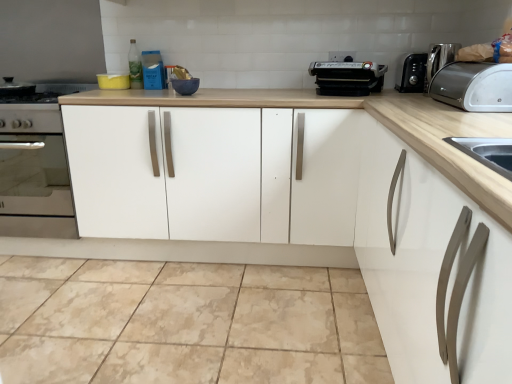
Question: From a real-world perspective, is satin silver toaster at upper right above or below green glass bottle at upper center?

Choices:
 (A) above
 (B) below

Answer: (B)

Question: Which is correct: satin silver toaster at upper right is inside green glass bottle at upper center, or outside of it?

Choices:
 (A) outside
 (B) inside

Answer: (A)

Question: Which of these objects is positioned farthest from the beige marble tile at center?

Choices:
 (A) satin silver coffee machine at upper right
 (B) white matte cabinet at center
 (C) green glass bottle at upper center
 (D) satin silver toaster at upper right
 (E) black plastic grill at upper center

Answer: (A)

Question: Which object is positioned closest to the satin silver toaster at upper right?

Choices:
 (A) black plastic grill at upper center
 (B) white matte cabinet at center
 (C) beige marble tile at center
 (D) green glass bottle at upper center
 (E) satin silver coffee machine at upper right

Answer: (E)